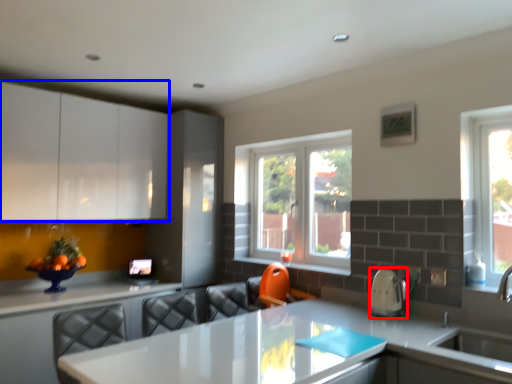
Question: Among these objects, which one is farthest to the camera, appliance (highlighted by a red box) or cabinetry (highlighted by a blue box)?

Choices:
 (A) appliance
 (B) cabinetry

Answer: (B)